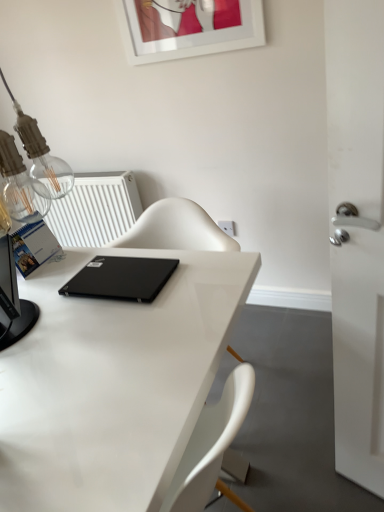
Question: In terms of height, does black matte laptop at center look taller or shorter compared to white glossy desk at center?

Choices:
 (A) tall
 (B) short

Answer: (B)

Question: Is point (137, 284) positioned closer to the camera than point (117, 453)?

Choices:
 (A) closer
 (B) farther

Answer: (B)

Question: Which is farther from the white plastic electric outlet at upper center?

Choices:
 (A) black matte laptop at center
 (B) white glossy picture frame at upper center
 (C) white plastic radiator at upper left
 (D) white glossy desk at center

Answer: (B)

Question: Which is nearer to the white plastic electric outlet at upper center?

Choices:
 (A) white glossy picture frame at upper center
 (B) white plastic radiator at upper left
 (C) black matte laptop at center
 (D) white glossy desk at center

Answer: (C)